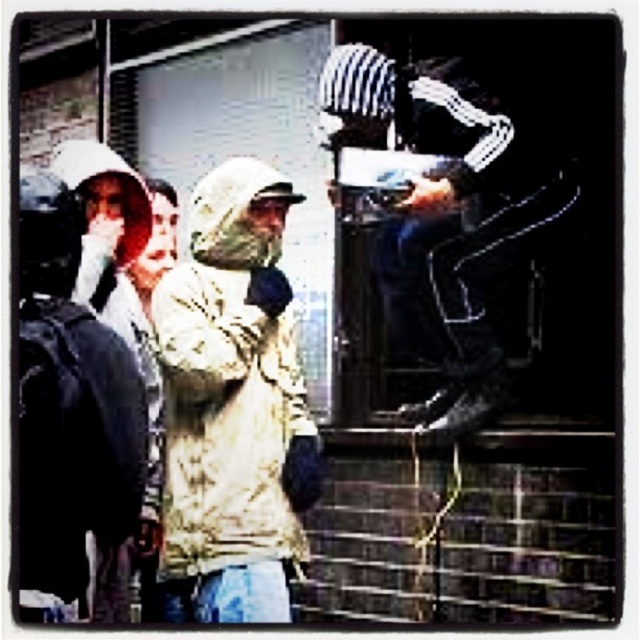
Question: Which of the following is the closest to the observer?

Choices:
 (A) (216, 397)
 (B) (369, 125)

Answer: (A)

Question: Does tan quilted fabric trench coat at center appear on the left side of matte black backpack at left?

Choices:
 (A) yes
 (B) no

Answer: (B)

Question: Which of these objects is positioned farthest from the white plastic bag at upper right?

Choices:
 (A) matte black backpack at left
 (B) tan quilted fabric trench coat at center

Answer: (A)

Question: Can you confirm if tan quilted fabric trench coat at center is thinner than matte black backpack at left?

Choices:
 (A) no
 (B) yes

Answer: (A)

Question: Among these points, which one is farthest from the camera?

Choices:
 (A) (60, 378)
 (B) (244, 544)

Answer: (B)

Question: In this image, where is tan quilted fabric trench coat at center located relative to matte black backpack at left?

Choices:
 (A) below
 (B) above

Answer: (A)